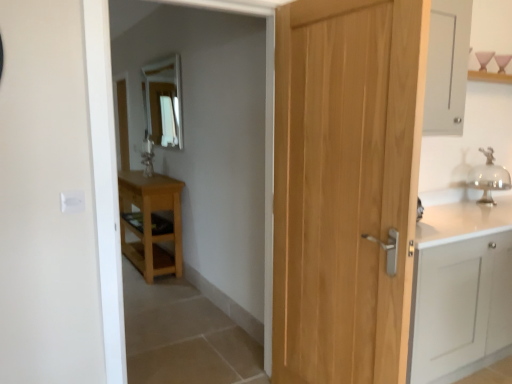
Question: Could you tell me if light wood table at left is facing clear glass bell at right?

Choices:
 (A) yes
 (B) no

Answer: (B)

Question: Is light wood table at left at the left side of clear glass bell at right?

Choices:
 (A) no
 (B) yes

Answer: (B)

Question: Can we say light wood table at left lies outside clear glass bell at right?

Choices:
 (A) yes
 (B) no

Answer: (A)

Question: Is light wood table at left placed right next to clear glass bell at right?

Choices:
 (A) no
 (B) yes

Answer: (A)

Question: Can you confirm if light wood table at left is wider than clear glass bell at right?

Choices:
 (A) no
 (B) yes

Answer: (B)

Question: Considering the relative sizes of light wood table at left and clear glass bell at right in the image provided, is light wood table at left bigger than clear glass bell at right?

Choices:
 (A) no
 (B) yes

Answer: (B)

Question: From the image's perspective, would you say light brown wood door at center is shown under clear glass bell at right?

Choices:
 (A) yes
 (B) no

Answer: (A)

Question: Considering the relative sizes of light brown wood door at center and clear glass bell at right in the image provided, is light brown wood door at center smaller than clear glass bell at right?

Choices:
 (A) yes
 (B) no

Answer: (B)

Question: Is the position of light brown wood door at center more distant than that of clear glass bell at right?

Choices:
 (A) yes
 (B) no

Answer: (B)

Question: From the image's perspective, is light brown wood door at center located above clear glass bell at right?

Choices:
 (A) no
 (B) yes

Answer: (A)

Question: Is clear glass bell at right at the back of light brown wood door at center?

Choices:
 (A) yes
 (B) no

Answer: (A)

Question: Is light brown wood door at center to the left of clear glass bell at right from the viewer's perspective?

Choices:
 (A) no
 (B) yes

Answer: (B)

Question: Is clear glass mirror at upper center to the left of light brown wood door at center from the viewer's perspective?

Choices:
 (A) no
 (B) yes

Answer: (B)